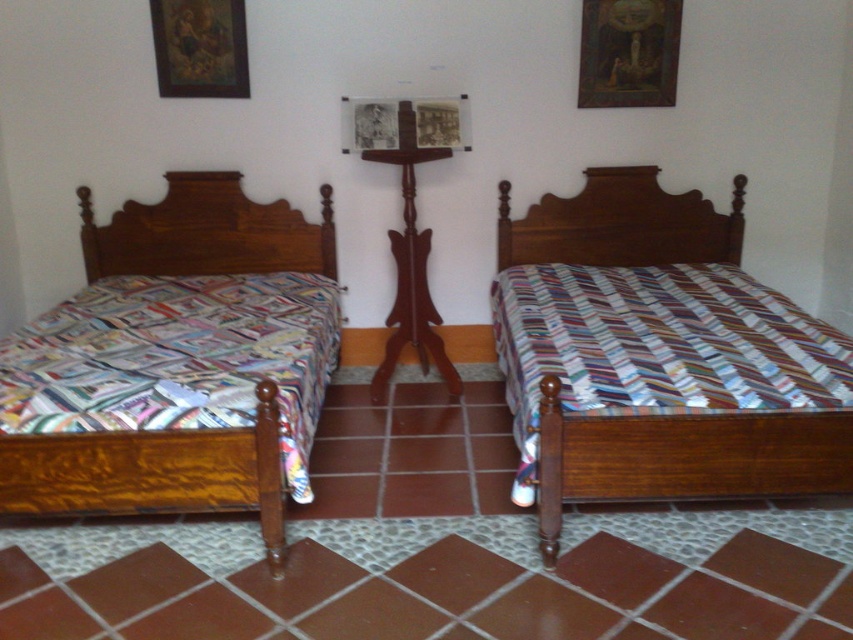
You are a painter who needs to hang a 24 inch wide painting on the wall between the wooden bed at left and the wooden picture frame at upper left. Is there enough space for the painting?

The distance between the wooden bed at left and the wooden picture frame at upper left is 26.71 inches. Since the painting is 24 inches wide, there is enough space to hang it between them.

You are organizing a small event in the bedroom and need to place a 1.5 meter long table between the wooden bed at left and the wooden picture frame at upper left. Considering their sizes, will the table fit without overlapping either object?

The wooden bed at left is larger than the wooden picture frame at upper left. Since the table is 1.5 meters long, it might not fit between them if the distance between the bed and the frame is less than 1.5 meters. However, the description only mentions their sizes, not the distance between them. Therefore, we cannot determine if the table will fit based on the provided information.